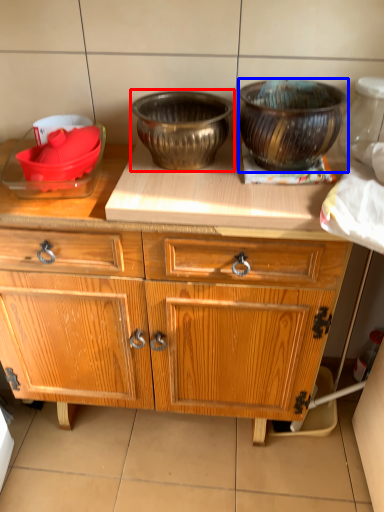
Question: Which of the following is the closest to the observer, bowl (highlighted by a red box) or bowl (highlighted by a blue box)?

Choices:
 (A) bowl
 (B) bowl

Answer: (B)